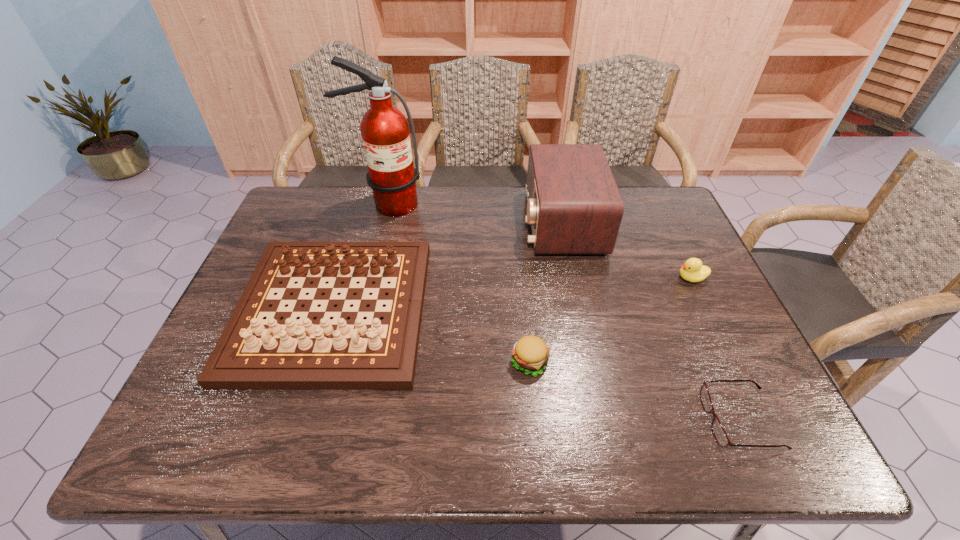
I want to click on free spot located on the side with the white pieces of the gameboard, so click(300, 419).

Where is `vacant position located on the beak of the duckling`? Image resolution: width=960 pixels, height=540 pixels. vacant position located on the beak of the duckling is located at coordinates (630, 278).

Image resolution: width=960 pixels, height=540 pixels. I want to click on vacant space located on the beak of the duckling, so (x=598, y=278).

Where is `free region located on the beak of the duckling`? The height and width of the screenshot is (540, 960). free region located on the beak of the duckling is located at coordinates (598, 278).

Identify the location of vacant area located 0.290m on the right of the hamburger. This screenshot has height=540, width=960. (673, 362).

The height and width of the screenshot is (540, 960). Identify the location of vacant area located on the lenses of the spectacles. (547, 420).

You are a GUI agent. You are given a task and a screenshot of the screen. Output one action in this format:
    pyautogui.click(x=<x>, y=<y>)
    Task: Click on the free spot located 0.290m on the lenses of the spectacles
    Image resolution: width=960 pixels, height=540 pixels.
    Given the screenshot: What is the action you would take?
    pyautogui.click(x=571, y=420)

I want to click on vacant area situated 0.310m on the lenses of the spectacles, so click(x=562, y=420).

At what (x,y) coordinates should I click in order to perform the action: click on fire extinguisher situated at the far edge. Please return your answer as a coordinate pair (x, y). The image size is (960, 540). Looking at the image, I should click on (385, 133).

Locate an element on the screen. radio receiver at the far edge is located at coordinates (574, 206).